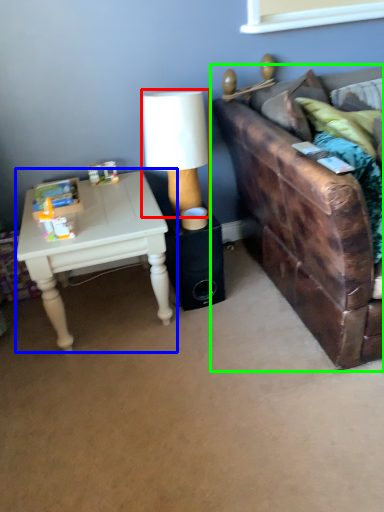
Question: Considering the real-world distances, which object is farthest from table lamp (highlighted by a red box)? table (highlighted by a blue box) or studio couch (highlighted by a green box)?

Choices:
 (A) table
 (B) studio couch

Answer: (B)